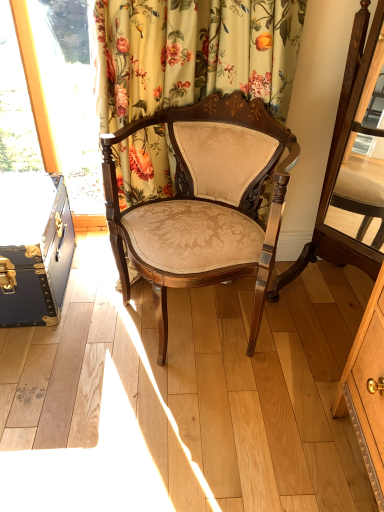
You are a GUI agent. You are given a task and a screenshot of the screen. Output one action in this format:
    pyautogui.click(x=<x>, y=<y>)
    Task: Click on the free space to the left of matte gold upholstery chair at center
    This screenshot has width=384, height=512.
    Given the screenshot: What is the action you would take?
    pyautogui.click(x=74, y=336)